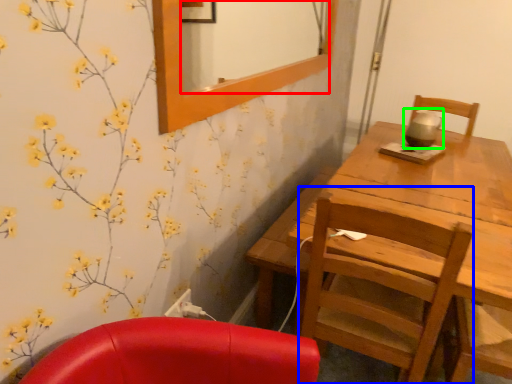
Question: Considering the real-world distances, which object is farthest from mirror (highlighted by a red box)? chair (highlighted by a blue box) or tea pot (highlighted by a green box)?

Choices:
 (A) chair
 (B) tea pot

Answer: (A)